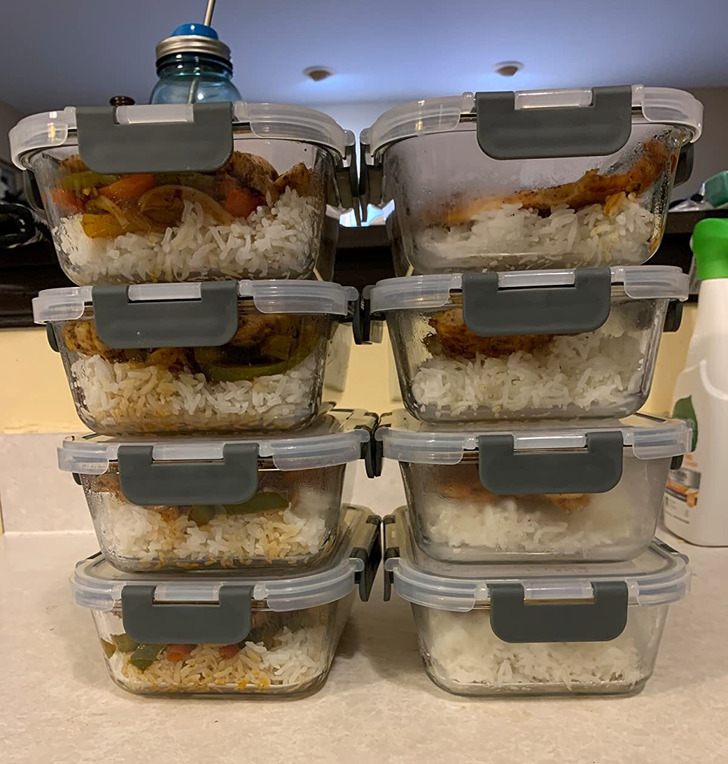
Identify the location of blue glass water bottle. (175, 86).